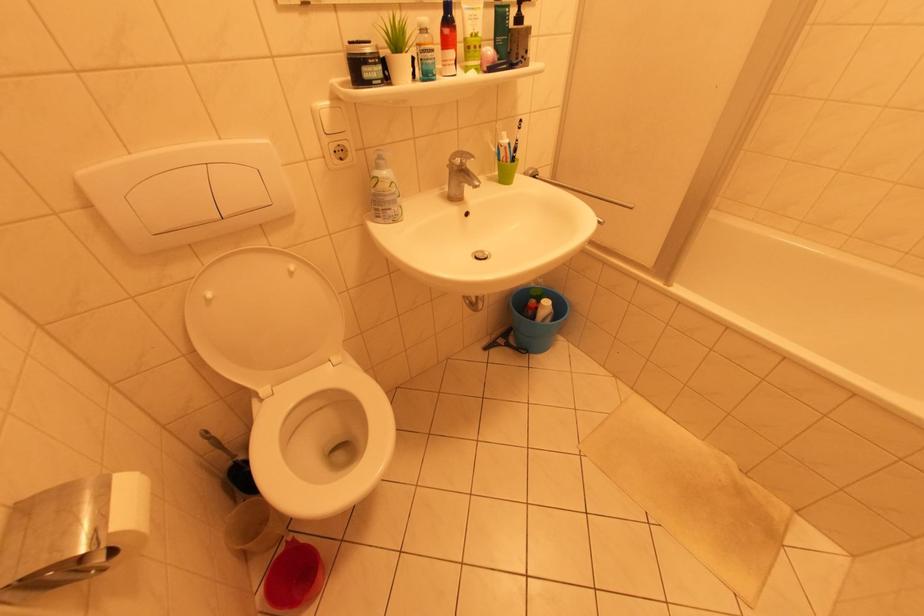
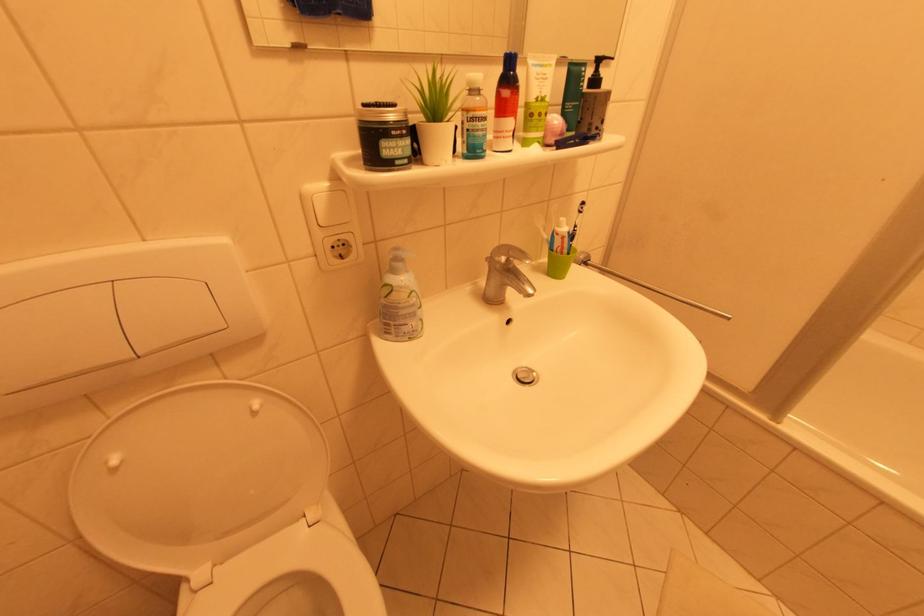
Question: The first image is from the beginning of the video and the second image is from the end. How did the camera likely rotate when shooting the video?

Choices:
 (A) Left
 (B) Right
 (C) Up
 (D) Down

Answer: (C)